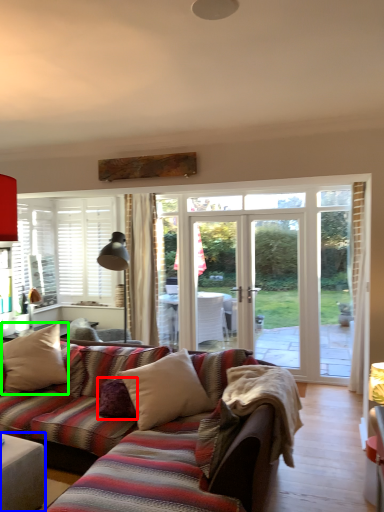
Question: Which is farther away from pillow (highlighted by a red box)? table (highlighted by a blue box) or pillow (highlighted by a green box)?

Choices:
 (A) table
 (B) pillow

Answer: (B)